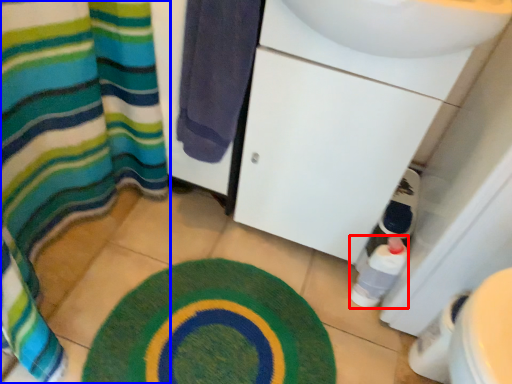
Question: Which point is further to the camera, bottle (highlighted by a red box) or curtain (highlighted by a blue box)?

Choices:
 (A) bottle
 (B) curtain

Answer: (B)